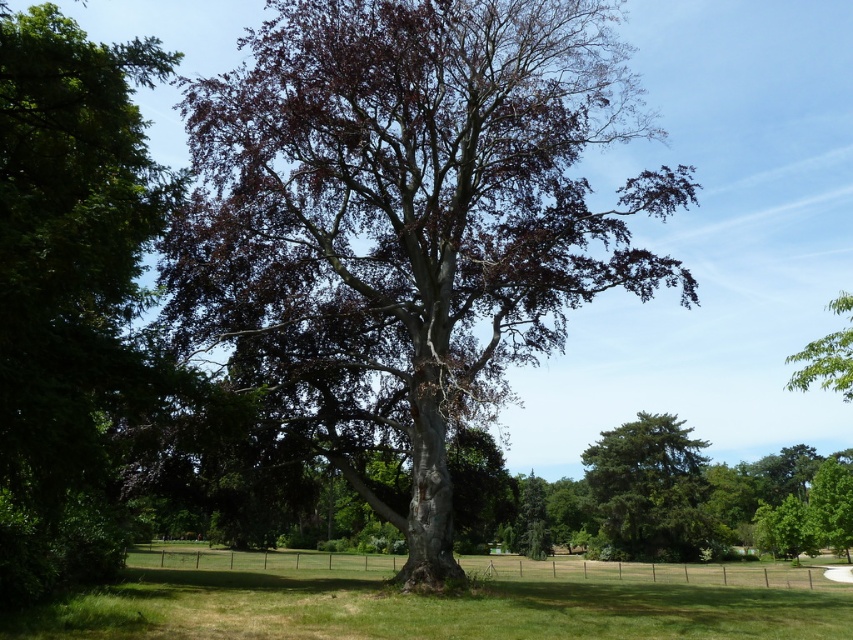
Question: Is dark brown bark tree at center closer to camera compared to green grass at lower center?

Choices:
 (A) no
 (B) yes

Answer: (A)

Question: Can you confirm if dark brown bark tree at center is thinner than green textured pine tree at center?

Choices:
 (A) no
 (B) yes

Answer: (A)

Question: Which point appears closest to the camera in this image?

Choices:
 (A) (844, 387)
 (B) (471, 563)
 (C) (564, 93)

Answer: (A)

Question: Does dark brown bark tree at center have a greater width compared to green leafy tree at upper right?

Choices:
 (A) no
 (B) yes

Answer: (A)

Question: Which object is farther from the camera taking this photo?

Choices:
 (A) green grass at lower center
 (B) green leafy tree at upper right
 (C) green textured pine tree at center
 (D) dark brown bark tree at center

Answer: (C)

Question: Which point is farther to the camera?

Choices:
 (A) (294, 154)
 (B) (647, 541)

Answer: (B)